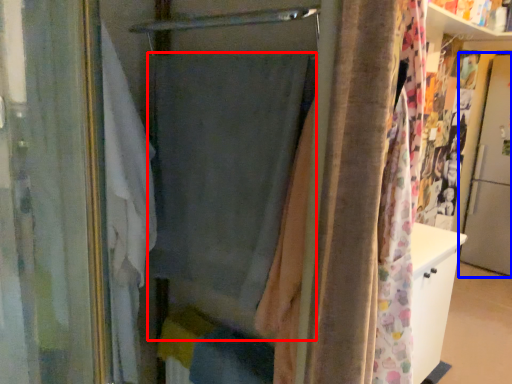
Question: Which of the following is the farthest to the observer, curtain (highlighted by a red box) or screen door (highlighted by a blue box)?

Choices:
 (A) curtain
 (B) screen door

Answer: (B)